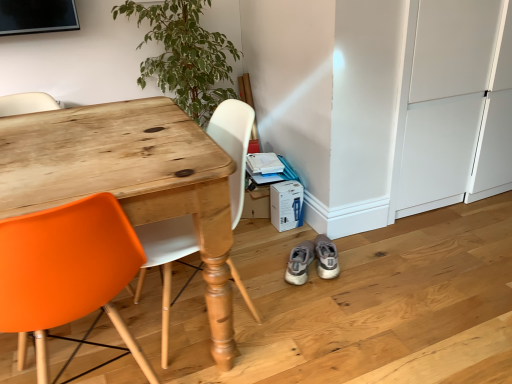
Question: Considering the relative sizes of green leafy plant at upper left and light gray suede sneakers at lower center, the 1th footwear from the right, in the image provided, is green leafy plant at upper left bigger than light gray suede sneakers at lower center, the 1th footwear from the right,?

Choices:
 (A) no
 (B) yes

Answer: (B)

Question: Is green leafy plant at upper left wider than light gray suede sneakers at lower center, the 1th footwear from the right?

Choices:
 (A) no
 (B) yes

Answer: (B)

Question: Is green leafy plant at upper left not inside light gray suede sneakers at lower center, positioned as the second footwear in left-to-right order?

Choices:
 (A) no
 (B) yes

Answer: (B)

Question: Is green leafy plant at upper left aimed at light gray suede sneakers at lower center, positioned as the second footwear in left-to-right order?

Choices:
 (A) yes
 (B) no

Answer: (A)

Question: From the image's perspective, is green leafy plant at upper left located above light gray suede sneakers at lower center, positioned as the second footwear in left-to-right order?

Choices:
 (A) no
 (B) yes

Answer: (B)

Question: Is green leafy plant at upper left at the right side of light gray suede sneakers at lower center, the 1th footwear from the right?

Choices:
 (A) no
 (B) yes

Answer: (A)

Question: Is light gray suede sneakers at lower center, positioned as the second footwear in left-to-right order, outside of wooden desk at left?

Choices:
 (A) no
 (B) yes

Answer: (B)

Question: Can you confirm if light gray suede sneakers at lower center, the 1th footwear from the right, is thinner than wooden desk at left?

Choices:
 (A) yes
 (B) no

Answer: (A)

Question: Is light gray suede sneakers at lower center, the 1th footwear from the right, turned away from wooden desk at left?

Choices:
 (A) no
 (B) yes

Answer: (A)

Question: Could wooden desk at left be considered to be inside light gray suede sneakers at lower center, positioned as the second footwear in left-to-right order?

Choices:
 (A) no
 (B) yes

Answer: (A)

Question: From a real-world perspective, is light gray suede sneakers at lower center, the 1th footwear from the right, on top of wooden desk at left?

Choices:
 (A) no
 (B) yes

Answer: (A)

Question: Can you confirm if light gray suede sneakers at lower center, the 1th footwear from the right, is wider than wooden desk at left?

Choices:
 (A) yes
 (B) no

Answer: (B)

Question: Can you confirm if light gray suede sneakers at lower center, positioned as the second footwear in left-to-right order, is taller than green leafy plant at upper left?

Choices:
 (A) yes
 (B) no

Answer: (B)